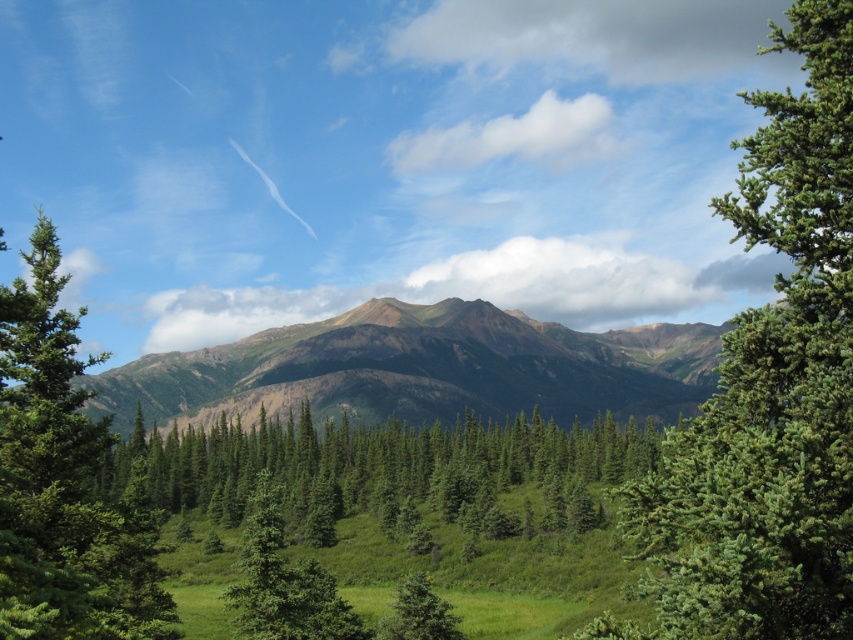
Can you confirm if green textured pine tree at center is thinner than green matte tree at center?

In fact, green textured pine tree at center might be wider than green matte tree at center.

Is green textured pine tree at center below green matte tree at center?

No.

The width and height of the screenshot is (853, 640). I want to click on green textured pine tree at center, so [x=772, y=385].

Is rustic brown mountain range at center bigger than green matte tree at center?

Yes.

Between point (627, 326) and point (212, 476), which one is positioned behind?

The point (627, 326) is more distant.

You are a GUI agent. You are given a task and a screenshot of the screen. Output one action in this format:
    pyautogui.click(x=<x>, y=<y>)
    Task: Click on the rustic brown mountain range at center
    This screenshot has height=640, width=853.
    Given the screenshot: What is the action you would take?
    pyautogui.click(x=421, y=369)

Which is behind, point (412, 480) or point (141, 621)?

Positioned behind is point (412, 480).

Between green matte tree at center and green matte tree at left, which one appears on the right side from the viewer's perspective?

green matte tree at center

Which is in front, point (427, 429) or point (9, 552)?

Point (9, 552)

You are a GUI agent. You are given a task and a screenshot of the screen. Output one action in this format:
    pyautogui.click(x=<x>, y=<y>)
    Task: Click on the green matte tree at center
    
    Given the screenshot: What is the action you would take?
    pyautogui.click(x=384, y=468)